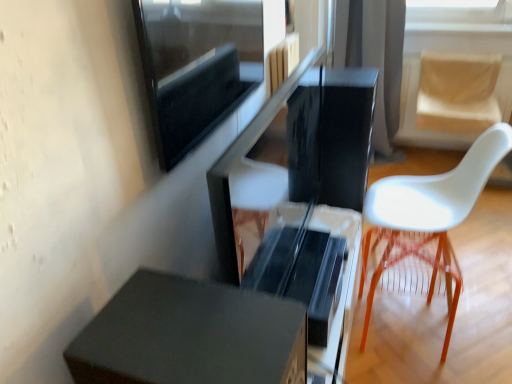
Question: From a real-world perspective, is matte black drawer at lower left beneath white plastic chair at right?

Choices:
 (A) yes
 (B) no

Answer: (B)

Question: Does matte black drawer at lower left lie in front of white plastic chair at right?

Choices:
 (A) yes
 (B) no

Answer: (A)

Question: From the image's perspective, is matte black drawer at lower left over white plastic chair at right?

Choices:
 (A) yes
 (B) no

Answer: (B)

Question: Can you confirm if matte black drawer at lower left is taller than white plastic chair at right?

Choices:
 (A) yes
 (B) no

Answer: (B)

Question: Is white plastic chair at right a part of matte black drawer at lower left?

Choices:
 (A) yes
 (B) no

Answer: (B)

Question: Is matte black drawer at lower left at the right side of white plastic chair at right?

Choices:
 (A) yes
 (B) no

Answer: (B)

Question: Is matte black screen at upper left further to camera compared to translucent orange stool at right?

Choices:
 (A) no
 (B) yes

Answer: (A)

Question: Can you confirm if matte black screen at upper left is shorter than translucent orange stool at right?

Choices:
 (A) no
 (B) yes

Answer: (B)

Question: Is matte black screen at upper left to the left of translucent orange stool at right from the viewer's perspective?

Choices:
 (A) no
 (B) yes

Answer: (B)

Question: Would you say matte black screen at upper left is a long distance from translucent orange stool at right?

Choices:
 (A) yes
 (B) no

Answer: (A)

Question: Are matte black screen at upper left and translucent orange stool at right making contact?

Choices:
 (A) no
 (B) yes

Answer: (A)

Question: Is matte black screen at upper left smaller than translucent orange stool at right?

Choices:
 (A) yes
 (B) no

Answer: (A)

Question: Is white plastic chair at right closer to the viewer compared to translucent orange stool at right?

Choices:
 (A) no
 (B) yes

Answer: (B)